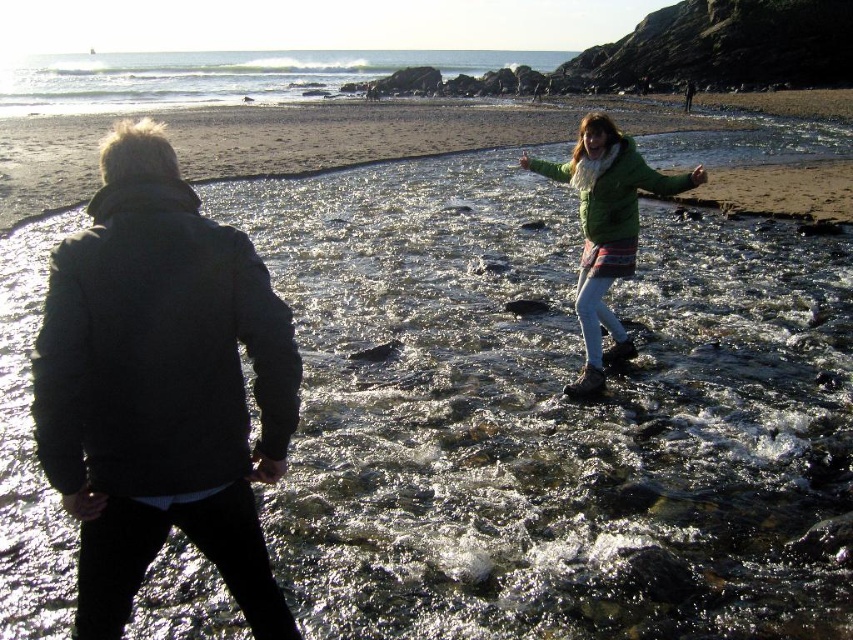
Question: Which of these objects is positioned farthest from the green matte jacket at center?

Choices:
 (A) clear water at upper center
 (B) dark gray wool jacket at left

Answer: (A)

Question: Observing the image, what is the correct spatial positioning of dark gray wool jacket at left in reference to smooth sand beach at upper center?

Choices:
 (A) above
 (B) below

Answer: (B)

Question: Which object is the closest to the green woolen jacket at upper right?

Choices:
 (A) dark gray wool jacket at left
 (B) clear water at upper center
 (C) smooth sand beach at upper center

Answer: (A)

Question: Does dark gray wool jacket at left appear on the right side of green matte jacket at center?

Choices:
 (A) no
 (B) yes

Answer: (A)

Question: Is green woolen jacket at upper right wider than green matte jacket at center?

Choices:
 (A) no
 (B) yes

Answer: (A)

Question: Which object is closer to the camera taking this photo?

Choices:
 (A) smooth sand beach at upper center
 (B) green matte jacket at center
 (C) clear water at upper center
 (D) green woolen jacket at upper right

Answer: (D)